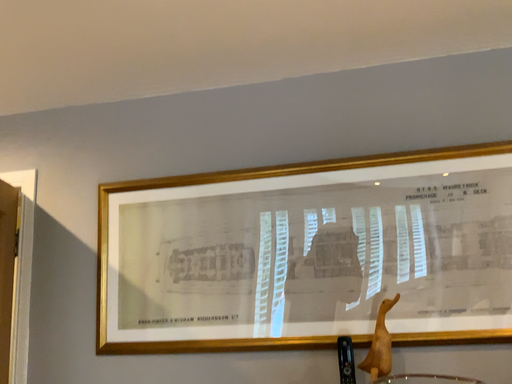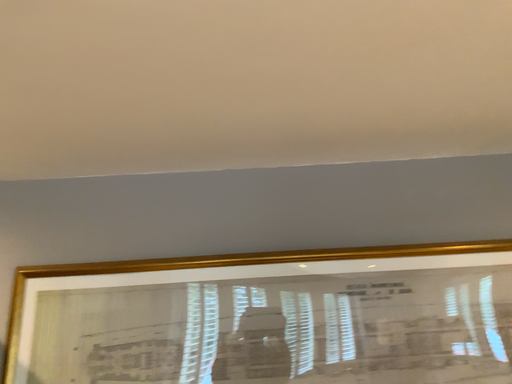
Question: Which way did the camera rotate in the video?

Choices:
 (A) rotated right
 (B) rotated left

Answer: (A)